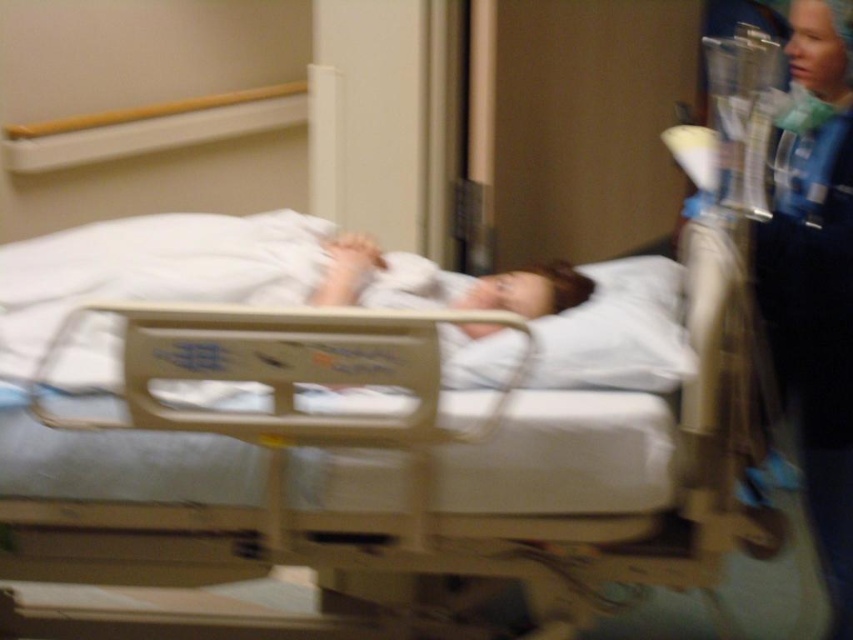
Consider the image. You are a nurse in a hospital and need to locate the beige plastic hospital bed at center. According to the coordinates provided, where exactly is it positioned in the image?

The beige plastic hospital bed at center is located at point coordinates of 0.717 in the x axis and 0.435 in the y axis.

You are a nurse entering the room and need to check the patient in the beige plastic hospital bed at center. The blue scrubs at right is a colleague. Which object should you approach first to reach the patient?

You should approach the beige plastic hospital bed at center first because it is closer to you than the blue scrubs at right, so it requires less movement to reach the patient.

You are a nurse who needs to move a medical cart from the hallway to the beige plastic hospital bed at center. The blue scrubs at right are standing in the way. Can you move the cart around them without hitting the bed or the scrubs?

The beige plastic hospital bed at center might be wider than blue scrubs at right, so you should move the cart carefully around the blue scrubs at right to avoid collision with the wider bed.